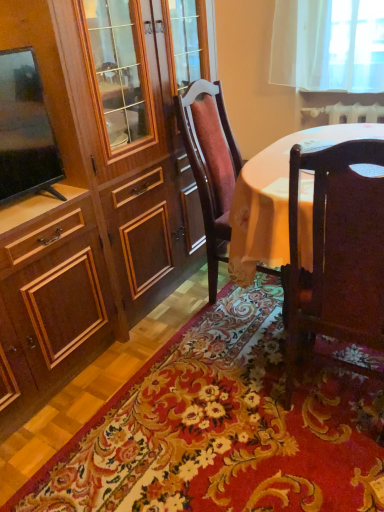
The image size is (384, 512). What are the coordinates of `free space to the left of dark wood chair at lower right, arranged as the 2th chair when viewed from the back` in the screenshot? It's located at (230, 433).